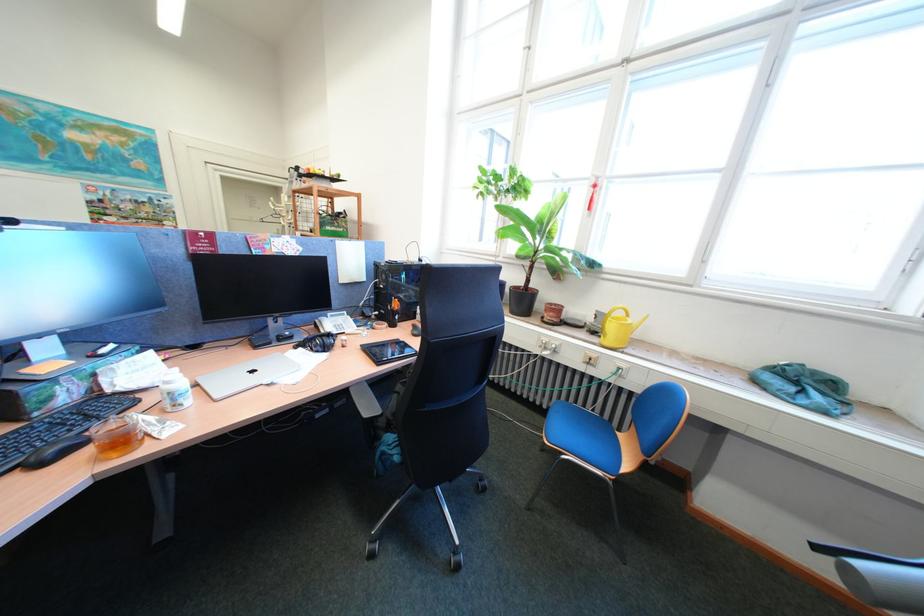
The width and height of the screenshot is (924, 616). What do you see at coordinates (582, 436) in the screenshot?
I see `the blue chair sitting surface` at bounding box center [582, 436].